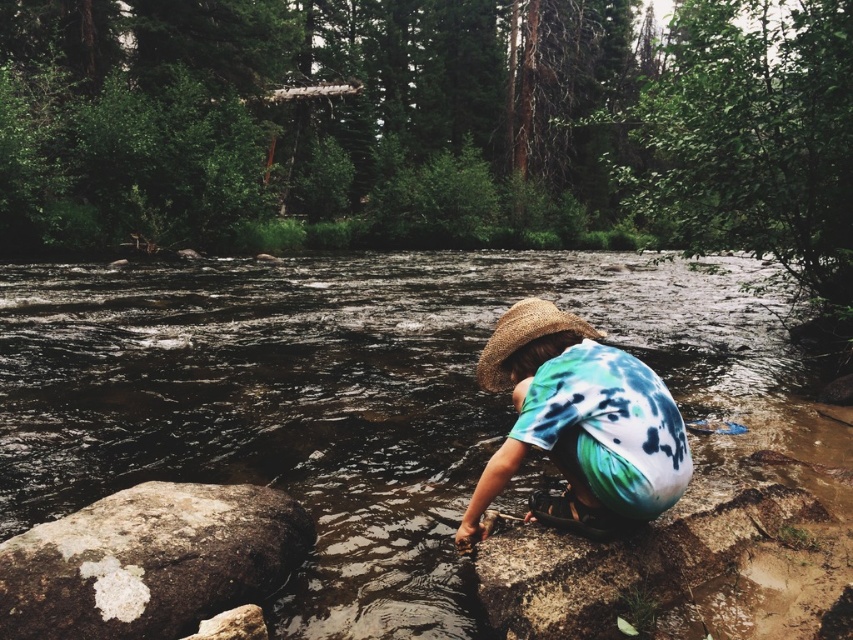
Question: Is brown rocky river at center wider than strawmaterial/texturehat at lower center?

Choices:
 (A) no
 (B) yes

Answer: (B)

Question: Which point is farther to the camera?

Choices:
 (A) [x=120, y=496]
 (B) [x=672, y=310]
 (C) [x=637, y=490]

Answer: (B)

Question: Does tie-dye fabric shirt at center appear under strawmaterial/texturehat at lower center?

Choices:
 (A) yes
 (B) no

Answer: (A)

Question: Where is brown rocky river at center located in relation to tie-dye fabric shirt at center in the image?

Choices:
 (A) right
 (B) left

Answer: (B)

Question: Which is nearer to the strawmaterial/texturehat at lower center?

Choices:
 (A) speckled brown rock at lower left
 (B) brown rocky river at center

Answer: (A)

Question: Estimate the real-world distances between objects in this image. Which object is closer to the brown rocky river at center?

Choices:
 (A) strawmaterial/texturehat at lower center
 (B) speckled brown rock at lower left

Answer: (B)